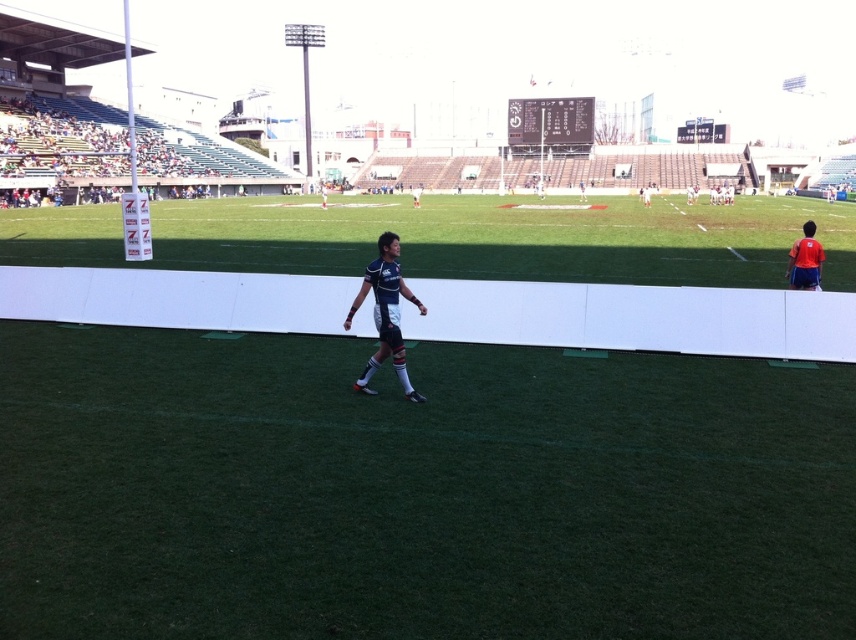
You are a spectator at the rugby match and want to locate the blue jersey at center. Which object in the image is located at the coordinates point (385, 314)?

The point (385, 314) is on the blue jersey at center.

You are a photographer positioned at the front of the stadium. You want to take a photo that includes both the blue jersey at center and the red fabric shirt at right. Which of the two objects should you focus on first to ensure both are in clear focus?

The blue jersey at center is closer to the viewer than the red fabric shirt at right. To ensure both are in clear focus, you should focus on the blue jersey at center first, as it is closer, and the depth of field will extend to the red fabric shirt at right.

You are a rugby player standing at the point with coordinates point (800, 241). You need to pass the ball to your teammate who is at point (415, 401). Will your pass go over any obstacles between these two points?

Point (415, 401) is in front of point (800, 241), so the pass will not go over any obstacles between these two points.